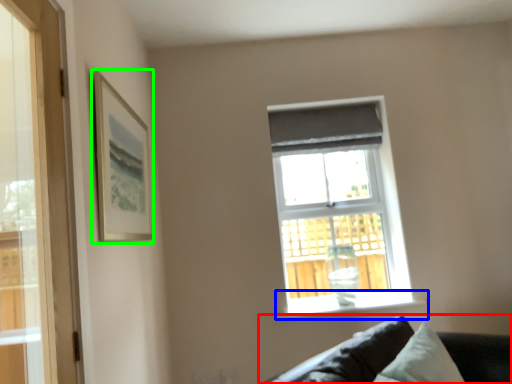
Question: Estimate the real-world distances between objects in this image. Which object is closer to studio couch (highlighted by a red box), window sill (highlighted by a blue box) or picture frame (highlighted by a green box)?

Choices:
 (A) window sill
 (B) picture frame

Answer: (A)